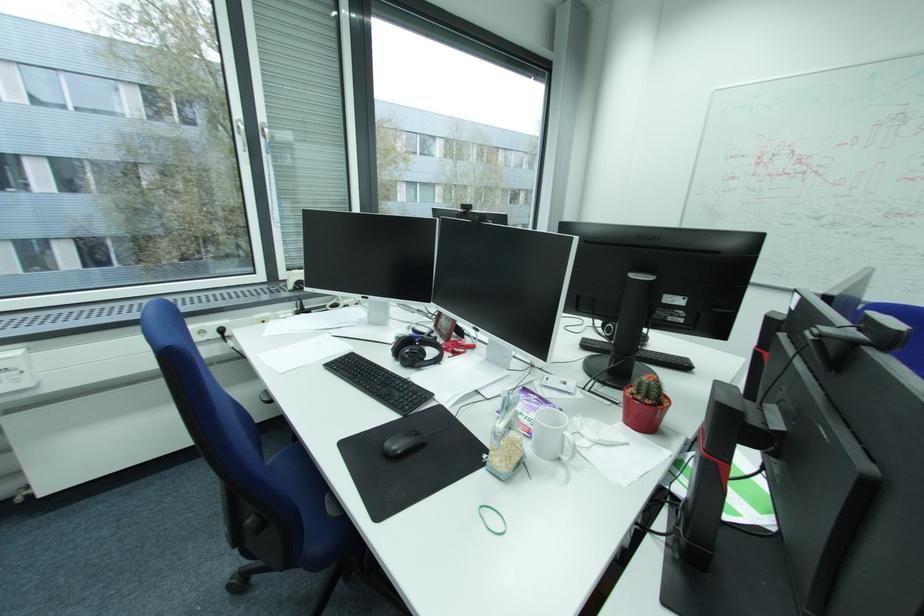
What do you see at coordinates (573, 448) in the screenshot? I see `the white mug handle` at bounding box center [573, 448].